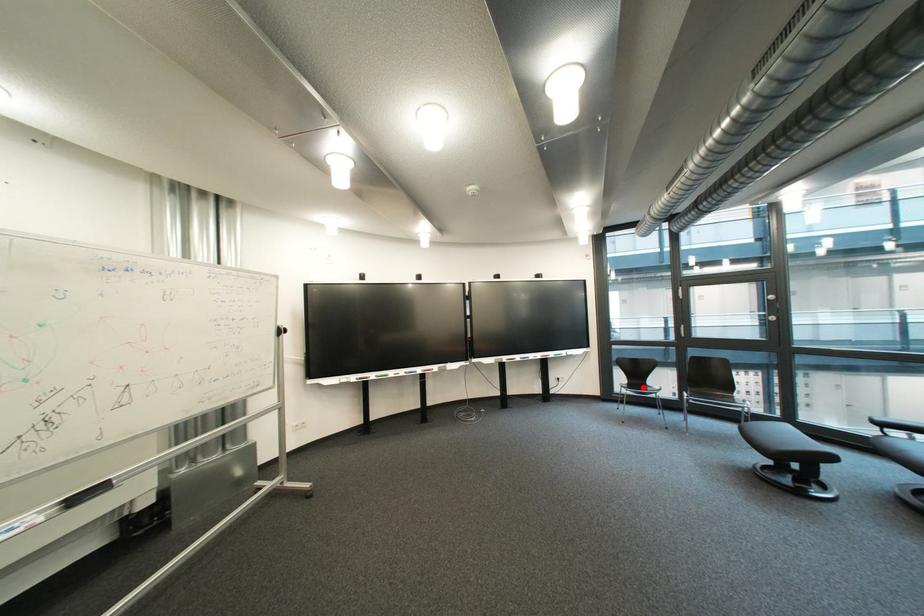
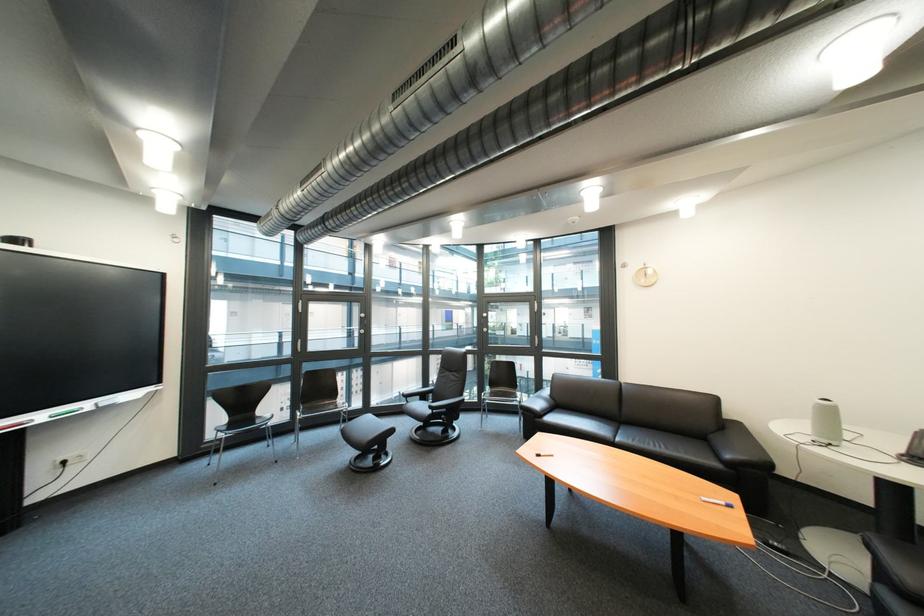
Question: A red point is marked in image1. In image2, is the corresponding 3D point closer to the camera or farther? Reply with the corresponding letter.

Choices:
 (A) The corresponding 3D point is closer.
 (B) The corresponding 3D point is farther.

Answer: (A)